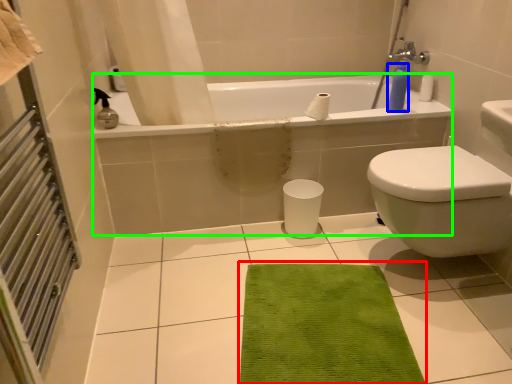
Question: Which is farther away from doormat (highlighted by a red box)? soap dispenser (highlighted by a blue box) or bath (highlighted by a green box)?

Choices:
 (A) soap dispenser
 (B) bath

Answer: (A)